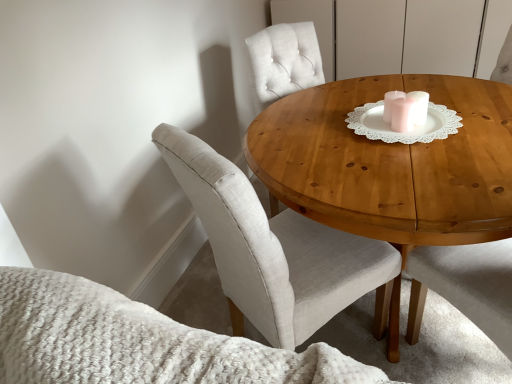
The width and height of the screenshot is (512, 384). I want to click on free spot to the right of white lace doily at center, so click(x=440, y=117).